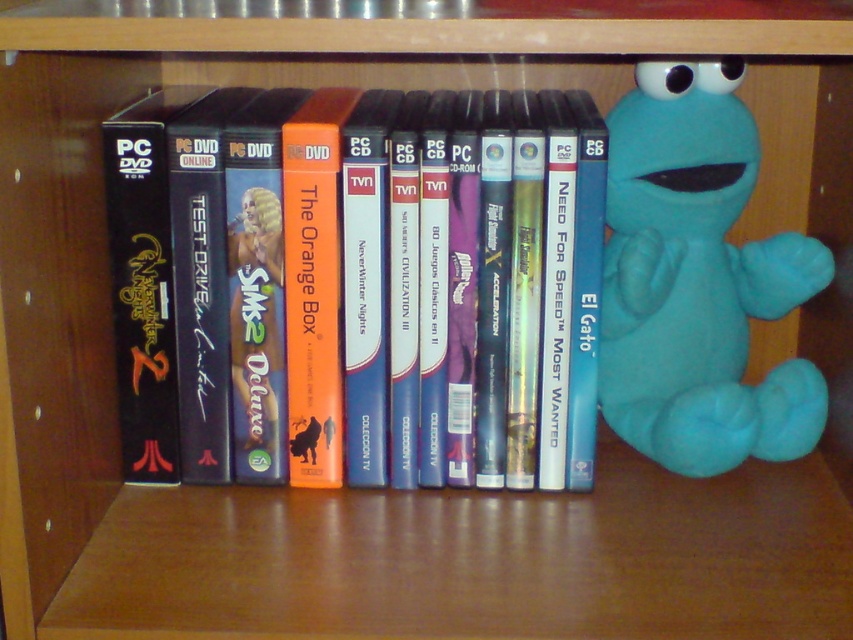
You are organizing a game library and need to locate the orange matte dvd case at center. According to the image, where exactly is it located?

The orange matte dvd case at center is located at point [467,282].

You need to place a new small book that is 10 cm in width on the shelf. The teal plush toy at right is currently occupying space. Can the orange matte dvd case at center be moved to make room for the book?

The orange matte dvd case at center is bigger than the teal plush toy at right, so moving it might require more space. However, since the teal plush toy at right is smaller, you could move it to make room for the book instead.